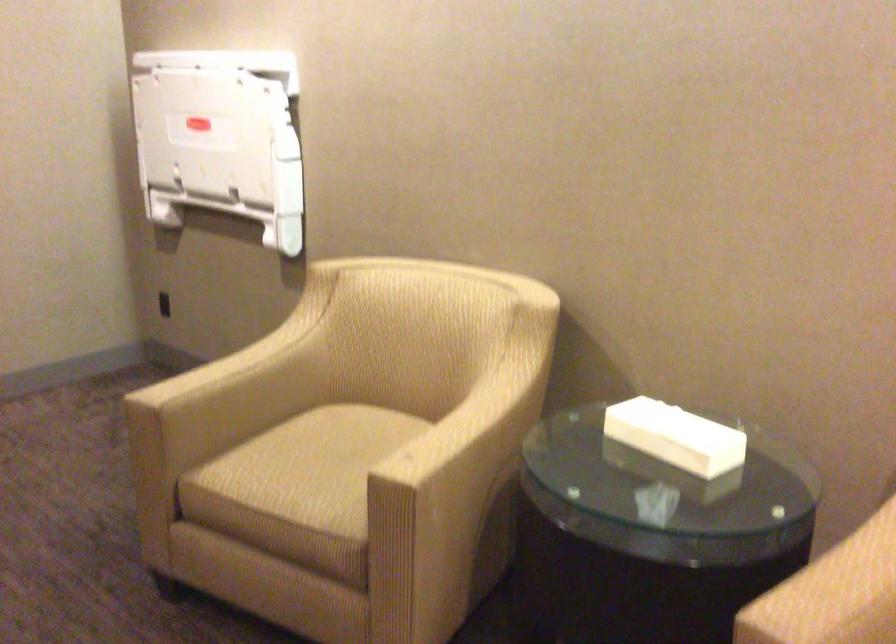
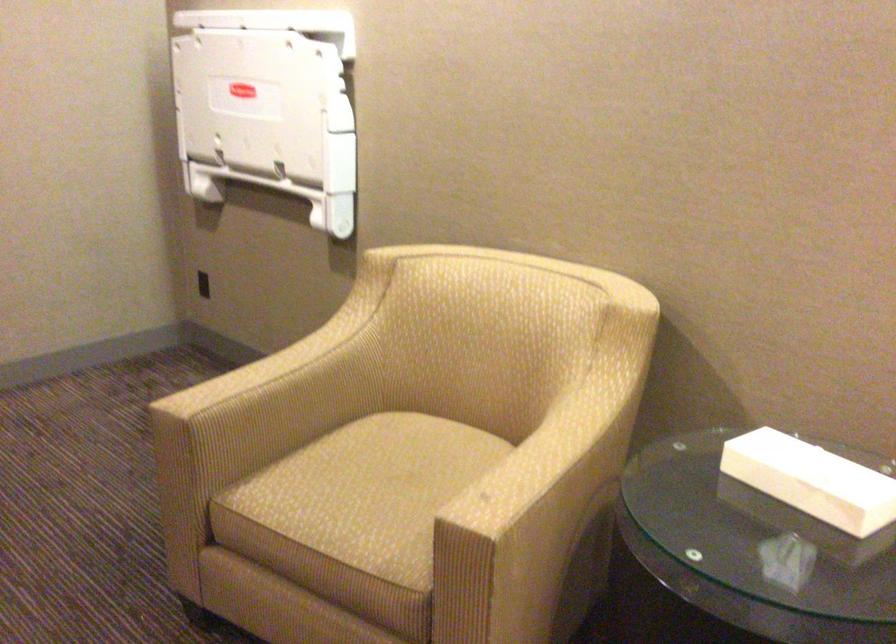
Find the pixel in the second image that matches pixel 672 438 in the first image.

(812, 480)